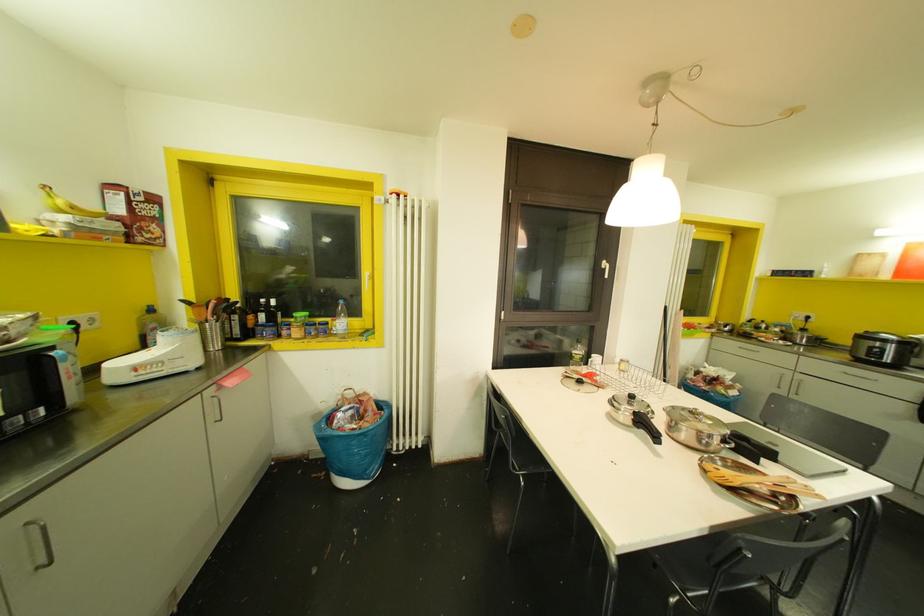
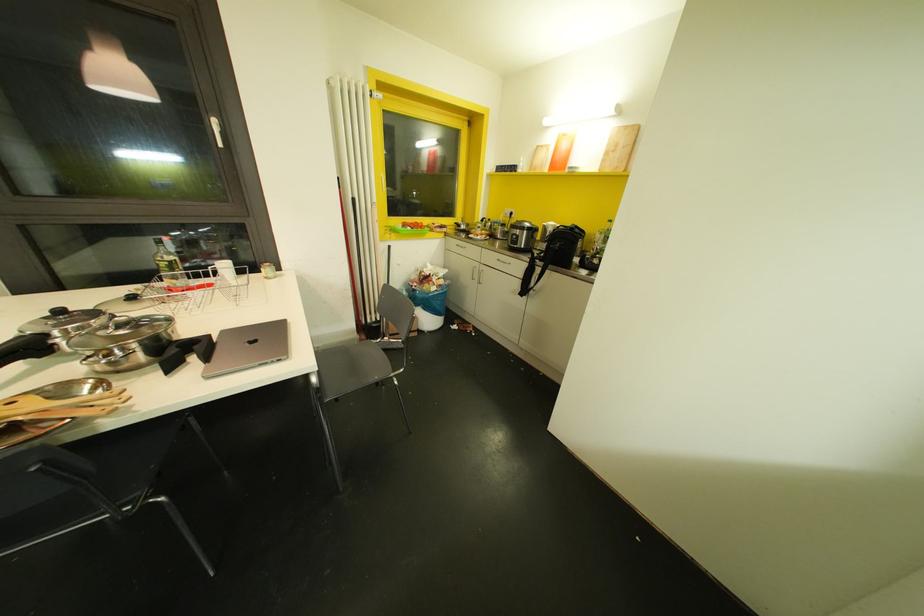
The point at (605, 276) is marked in the first image. Where is the corresponding point in the second image?

(220, 145)